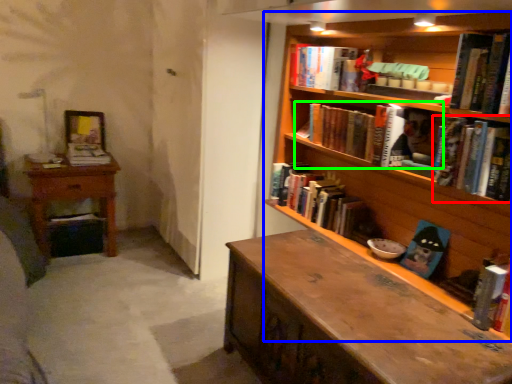
Question: Which object is positioned farthest from book (highlighted by a red box)? Select from bookcase (highlighted by a blue box) and book (highlighted by a green box).

Choices:
 (A) bookcase
 (B) book

Answer: (B)